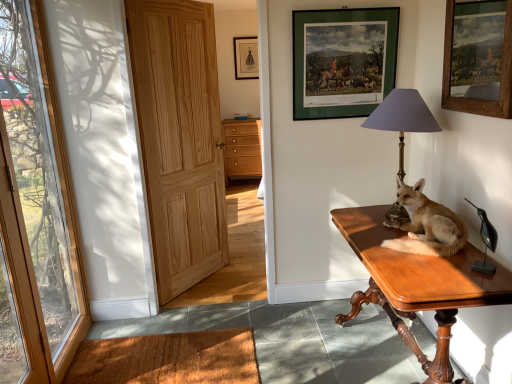
In order to face shiny brown wooden desk at right, should I rotate leftwards or rightwards?

A: To align with it, rotate right about 19.322°.

The width and height of the screenshot is (512, 384). What do you see at coordinates (246, 58) in the screenshot?
I see `matte black dress at upper center, which ranks as the 3th picture frame in bottom-to-top order` at bounding box center [246, 58].

The width and height of the screenshot is (512, 384). I want to click on natural wood door at left, the second door when ordered from left to right, so click(179, 138).

Locate an element on the screen. Image resolution: width=512 pixels, height=384 pixels. green matte picture frame at upper center, which is counted as the 2th picture frame, starting from the top is located at coordinates (343, 59).

In order to face green matte picture frame at upper center, which is counted as the 2th picture frame, starting from the top, should I rotate leftwards or rightwards?

Rotate your view right by about 12.078°.

Locate an element on the screen. The height and width of the screenshot is (384, 512). black glossy bird at right is located at coordinates (485, 242).

In order to face matte purple lampshade at center, should I rotate leftwards or rightwards?

To align with it, rotate right about 18.747°.

Find the location of a particular element. shiny brown wooden desk at right is located at coordinates (417, 283).

Which of these two, wooden-framed painting at upper right, arranged as the first picture frame when viewed from the right, or brown fur stuffed fox at right, is wider?

brown fur stuffed fox at right.

From the image's perspective, which is below, wooden-framed painting at upper right, arranged as the first picture frame when viewed from the right, or brown fur stuffed fox at right?

brown fur stuffed fox at right appears lower in the image.

Is brown fur stuffed fox at right at the back of wooden-framed painting at upper right, the third picture frame when ordered from left to right?

No.

Can we say wooden-framed painting at upper right, the third picture frame when ordered from left to right, lies outside brown fur stuffed fox at right?

Indeed, wooden-framed painting at upper right, the third picture frame when ordered from left to right, is completely outside brown fur stuffed fox at right.

From a real-world perspective, between matte purple lampshade at center and wooden door at left, which ranks as the first door in left-to-right order, who is vertically higher?

matte purple lampshade at center is physically above.

Does matte purple lampshade at center contain wooden door at left, positioned as the second door in right-to-left order?

No, wooden door at left, positioned as the second door in right-to-left order, is not a part of matte purple lampshade at center.

Is matte purple lampshade at center oriented towards wooden door at left, which ranks as the first door in left-to-right order?

Yes, matte purple lampshade at center is oriented towards wooden door at left, which ranks as the first door in left-to-right order.

Considering the relative sizes of matte purple lampshade at center and wooden door at left, which ranks as the first door in left-to-right order, in the image provided, is matte purple lampshade at center smaller than wooden door at left, which ranks as the first door in left-to-right order,?

Yes.

From the picture: Are green matte picture frame at upper center, which is the second picture frame in left-to-right order, and wooden-framed painting at upper right, which is counted as the 3th picture frame, starting from the top, beside each other?

No, green matte picture frame at upper center, which is the second picture frame in left-to-right order, is not in contact with wooden-framed painting at upper right, which is counted as the 3th picture frame, starting from the top.

Is green matte picture frame at upper center, the second picture frame viewed from the front, to the left of wooden-framed painting at upper right, the third picture frame in the back-to-front sequence, from the viewer's perspective?

Yes.

Measure the distance between green matte picture frame at upper center, arranged as the second picture frame when ordered from the bottom, and wooden-framed painting at upper right, which is counted as the 3th picture frame, starting from the top.

They are 21.89 inches apart.

Is brown shaggy carpet at lower left at the left side of brown fur stuffed fox at right?

Yes.

Can you confirm if brown shaggy carpet at lower left is wider than brown fur stuffed fox at right?

Yes.

Is brown shaggy carpet at lower left not near brown fur stuffed fox at right?

That's not correct — brown shaggy carpet at lower left is a little close to brown fur stuffed fox at right.

From the image's perspective, which one is positioned lower, brown shaggy carpet at lower left or brown fur stuffed fox at right?

brown shaggy carpet at lower left.

From a real-world perspective, which is physically above, matte purple lampshade at center or brown coir mat at lower left?

From a 3D spatial view, matte purple lampshade at center is above.

Is the surface of matte purple lampshade at center in direct contact with brown coir mat at lower left?

No, matte purple lampshade at center is not touching brown coir mat at lower left.

Is matte purple lampshade at center not inside brown coir mat at lower left?

That's correct, matte purple lampshade at center is outside of brown coir mat at lower left.

Is natural wood door at left, the 1th door when ordered from right to left, inside or outside of green matte picture frame at upper center, arranged as the second picture frame when ordered from the bottom?

natural wood door at left, the 1th door when ordered from right to left, is spatially situated outside green matte picture frame at upper center, arranged as the second picture frame when ordered from the bottom.

How many degrees apart are the facing directions of natural wood door at left, the 1th door when ordered from right to left, and green matte picture frame at upper center, arranged as the second picture frame when ordered from the bottom?

54.4 degrees separate the facing orientations of natural wood door at left, the 1th door when ordered from right to left, and green matte picture frame at upper center, arranged as the second picture frame when ordered from the bottom.

Considering their positions, is natural wood door at left, the 1th door when ordered from right to left, located in front of or behind green matte picture frame at upper center, which is the second picture frame in left-to-right order?

natural wood door at left, the 1th door when ordered from right to left, is in front of green matte picture frame at upper center, which is the second picture frame in left-to-right order.

The image size is (512, 384). In order to click on mat below the wooden door at left, which ranks as the first door in left-to-right order (from a real-world perspective) in this screenshot , I will do `click(168, 359)`.

Does brown coir mat at lower left turn towards wooden door at left, positioned as the second door in right-to-left order?

No, brown coir mat at lower left is not turned towards wooden door at left, positioned as the second door in right-to-left order.

Is brown coir mat at lower left positioned far away from wooden door at left, which ranks as the first door in left-to-right order?

They are positioned close to each other.

Find the location of a particular element. This screenshot has height=384, width=512. dog behind the wooden-framed painting at upper right, the third picture frame when ordered from left to right is located at coordinates (426, 224).

Find the location of a particular element. the 2nd door counting from the left of the matte purple lampshade at center is located at coordinates (35, 211).

Estimate the real-world distances between objects in this image. Which object is further from brown coir mat at lower left, black glossy bird at right or matte purple lampshade at center?

The object further to brown coir mat at lower left is black glossy bird at right.

From the image, which object appears to be nearer to green matte picture frame at upper center, positioned as the second picture frame in right-to-left order, brown shaggy carpet at lower left or wooden door at left, which ranks as the first door in left-to-right order?

brown shaggy carpet at lower left is closer to green matte picture frame at upper center, positioned as the second picture frame in right-to-left order.

When comparing their distances from natural wood door at left, the second door when ordered from left to right, does brown shaggy carpet at lower left or shiny brown wooden desk at right seem further?

The object further to natural wood door at left, the second door when ordered from left to right, is shiny brown wooden desk at right.

Looking at the image, which one is located closer to brown coir mat at lower left, wooden door at left, which ranks as the first door in left-to-right order, or wooden-framed painting at upper right, which is counted as the 3th picture frame, starting from the top?

Among the two, wooden door at left, which ranks as the first door in left-to-right order, is located nearer to brown coir mat at lower left.

When comparing their distances from wooden-framed painting at upper right, the third picture frame in the back-to-front sequence, does matte purple lampshade at center or matte wood cabinet at center seem further?

matte wood cabinet at center.

Estimate the real-world distances between objects in this image. Which object is further from natural wood door at left, the 1th door when ordered from right to left, wooden-framed painting at upper right, the third picture frame when ordered from left to right, or shiny brown wooden desk at right?

Among the two, wooden-framed painting at upper right, the third picture frame when ordered from left to right, is located further to natural wood door at left, the 1th door when ordered from right to left.

From the image, which object appears to be nearer to wooden-framed painting at upper right, marked as the 1th picture frame in a bottom-to-top arrangement, brown coir mat at lower left or wooden door at left, which ranks as the first door in left-to-right order?

brown coir mat at lower left.

Based on their spatial positions, is matte black dress at upper center, which appears as the 3th picture frame when viewed from the right, or black glossy bird at right further from matte purple lampshade at center?

matte black dress at upper center, which appears as the 3th picture frame when viewed from the right, is positioned further to the anchor matte purple lampshade at center.

You are a GUI agent. You are given a task and a screenshot of the screen. Output one action in this format:
    pyautogui.click(x=<x>, y=<y>)
    Task: Click on the lamp between brown fur stuffed fox at right and matte black dress at upper center, which appears as the 3th picture frame when viewed from the right, from front to back
    This screenshot has height=384, width=512.
    Given the screenshot: What is the action you would take?
    pyautogui.click(x=402, y=118)

Locate an element on the screen. Image resolution: width=512 pixels, height=384 pixels. picture frame between green matte picture frame at upper center, which is the second picture frame in left-to-right order, and brown coir mat at lower left vertically is located at coordinates (478, 58).

Image resolution: width=512 pixels, height=384 pixels. Find the location of `mat between brown shaggy carpet at lower left and matte black dress at upper center, which appears as the 3th picture frame when viewed from the right, from front to back`. mat between brown shaggy carpet at lower left and matte black dress at upper center, which appears as the 3th picture frame when viewed from the right, from front to back is located at coordinates (168, 359).

You are a GUI agent. You are given a task and a screenshot of the screen. Output one action in this format:
    pyautogui.click(x=<x>, y=<y>)
    Task: Click on the lamp located between wooden door at left, which ranks as the first door in left-to-right order, and black glossy bird at right in the left-right direction
    This screenshot has height=384, width=512.
    Given the screenshot: What is the action you would take?
    pyautogui.click(x=402, y=118)